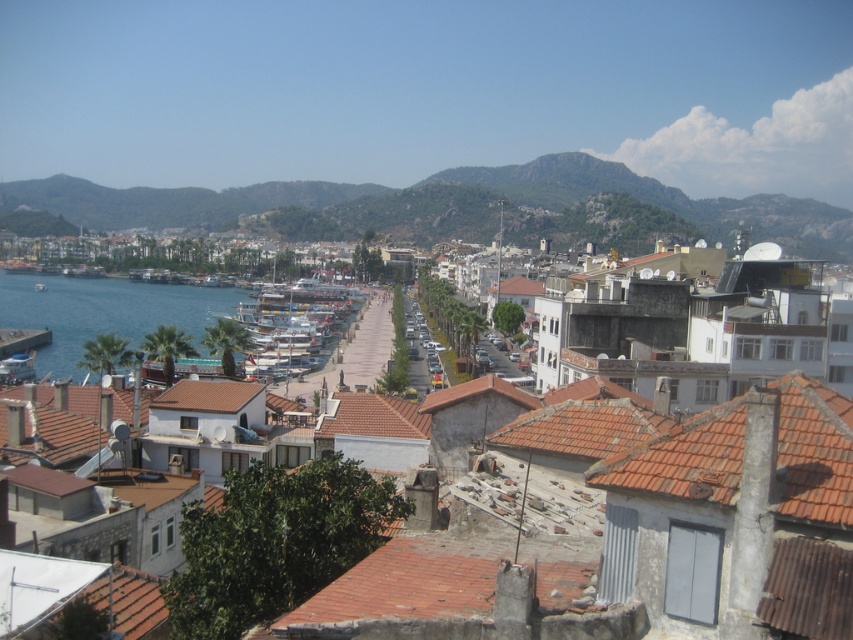
Is brown tiled roofs at center to the left of white glossy boat at center from the viewer's perspective?

No, brown tiled roofs at center is not to the left of white glossy boat at center.

Is brown tiled roofs at center above white glossy boat at center?

Incorrect, brown tiled roofs at center is not positioned above white glossy boat at center.

Who is more distant from viewer, (809, 628) or (357, 305)?

The point (357, 305) is more distant.

Locate an element on the screen. Image resolution: width=853 pixels, height=640 pixels. brown tiled roofs at center is located at coordinates (651, 529).

Describe the element at coordinates (453, 209) in the screenshot. I see `green leafy hillside at upper center` at that location.

Can you confirm if green leafy hillside at upper center is taller than white glossy boat at center?

Yes.

Between point (445, 198) and point (285, 292), which one is positioned behind?

Positioned behind is point (445, 198).

Identify the location of green leafy hillside at upper center. Image resolution: width=853 pixels, height=640 pixels. (453, 209).

Consider the image. Can you confirm if blue water at lower left is thinner than white glossy boat at center?

No.

How distant is blue water at lower left from white glossy boat at center?

A distance of 39.12 meters exists between blue water at lower left and white glossy boat at center.

Who is more forward, (200, 348) or (288, 336)?

Point (200, 348)

I want to click on blue water at lower left, so (x=103, y=312).